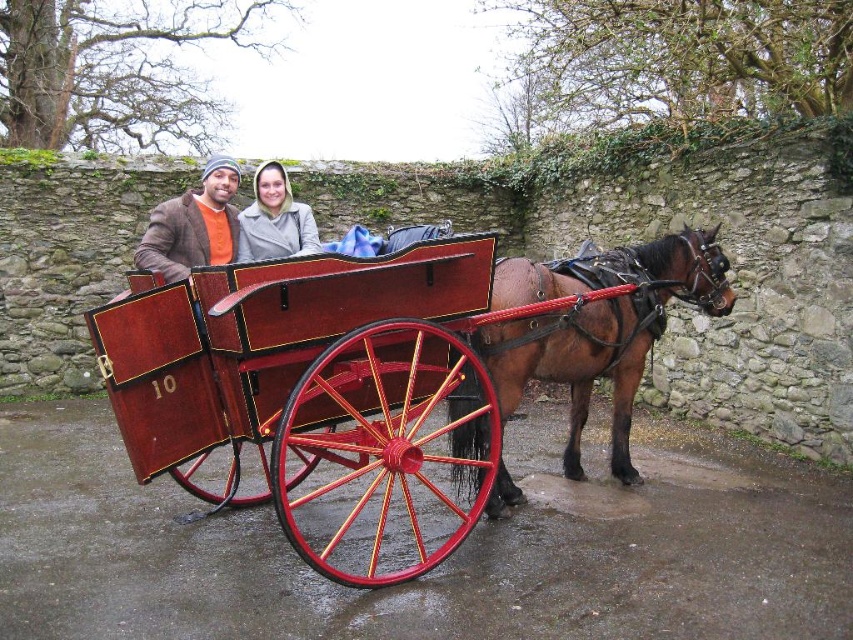
Question: From the image, what is the correct spatial relationship of shiny wood cart at center in relation to brown glossy horse at center?

Choices:
 (A) left
 (B) right

Answer: (A)

Question: Which is nearer to the brown glossy horse at center?

Choices:
 (A) shiny wood cart at center
 (B) matte gray hoodie at center
 (C) matte brown coat at center

Answer: (A)

Question: Which of these objects is positioned farthest from the matte brown coat at center?

Choices:
 (A) brown glossy horse at center
 (B) shiny wood cart at center

Answer: (A)

Question: Does brown glossy horse at center have a greater width compared to matte gray hoodie at center?

Choices:
 (A) yes
 (B) no

Answer: (A)

Question: Can you confirm if shiny wood cart at center is positioned to the left of matte brown coat at center?

Choices:
 (A) no
 (B) yes

Answer: (A)

Question: Among these objects, which one is farthest from the camera?

Choices:
 (A) shiny wood cart at center
 (B) matte brown coat at center
 (C) matte gray hoodie at center

Answer: (C)